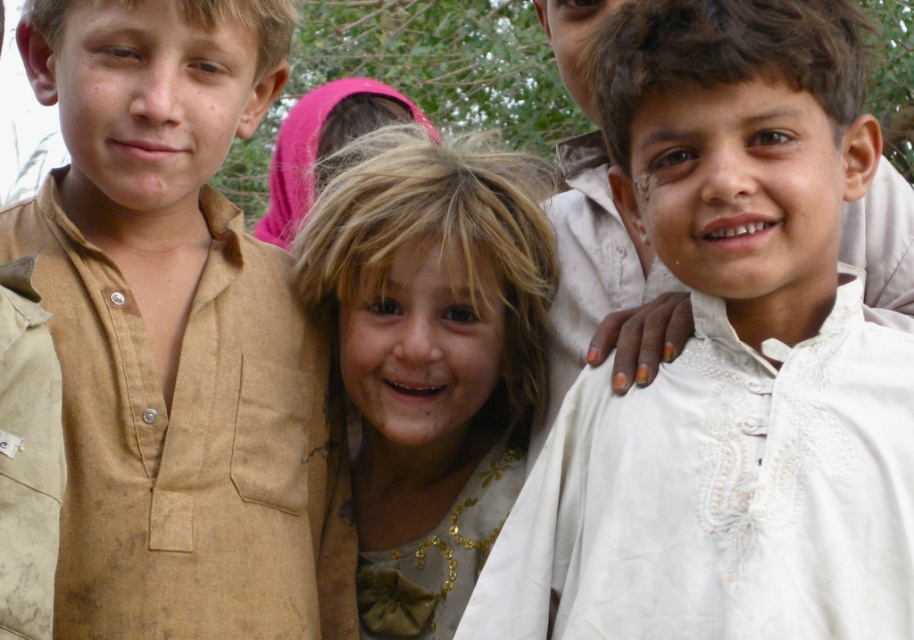
You are a photographer trying to capture a group shot of the children. You want to ensure that the white embroidered shirt at center and the brown cotton shirt at left are both in the frame. Based on their positions, which child should you position closer to the left side of the camera frame?

The brown cotton shirt at left should be positioned closer to the left side of the camera frame because it is already located to the left of the white embroidered shirt at center.

You are a photographer adjusting your camera to focus on two points in the image. The first point is at coordinate point (849, 179) and the second is at point (342, 317). Which point should you focus on first if you want to capture the closest object to the camera?

Point (849, 179) is closer to the camera than point (342, 317), so you should focus on point (849, 179) first to capture the closest object to the camera.